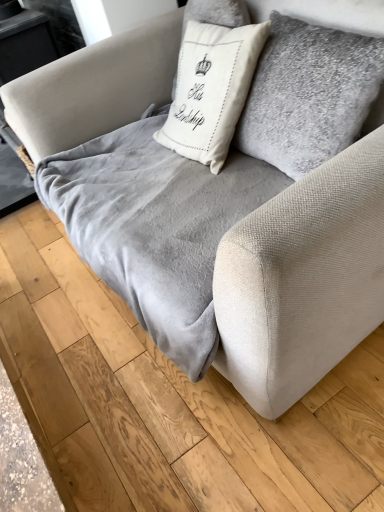
Question: Can velvet gray blanket at center be found inside white cotton cushion at center?

Choices:
 (A) no
 (B) yes

Answer: (A)

Question: Can you confirm if white cotton cushion at center is smaller than velvet gray blanket at center?

Choices:
 (A) yes
 (B) no

Answer: (A)

Question: From a real-world perspective, is white cotton cushion at center physically above velvet gray blanket at center?

Choices:
 (A) no
 (B) yes

Answer: (B)

Question: Does white cotton cushion at center have a greater width compared to velvet gray blanket at center?

Choices:
 (A) no
 (B) yes

Answer: (A)

Question: Is white cotton cushion at center positioned beyond the bounds of velvet gray blanket at center?

Choices:
 (A) yes
 (B) no

Answer: (A)

Question: Does white cotton cushion at center appear on the right side of velvet gray blanket at center?

Choices:
 (A) yes
 (B) no

Answer: (A)

Question: Is velvet gray blanket at center completely or partially outside of white cotton cushion at center?

Choices:
 (A) yes
 (B) no

Answer: (A)

Question: From a real-world perspective, is velvet gray blanket at center located beneath white cotton cushion at center?

Choices:
 (A) yes
 (B) no

Answer: (A)

Question: Can you confirm if velvet gray blanket at center is wider than white cotton cushion at center?

Choices:
 (A) no
 (B) yes

Answer: (B)

Question: From a real-world perspective, does velvet gray blanket at center stand above white cotton cushion at center?

Choices:
 (A) no
 (B) yes

Answer: (A)

Question: Is velvet gray blanket at center oriented towards white cotton cushion at center?

Choices:
 (A) yes
 (B) no

Answer: (B)

Question: Considering the relative sizes of velvet gray blanket at center and white cotton cushion at center in the image provided, is velvet gray blanket at center taller than white cotton cushion at center?

Choices:
 (A) yes
 (B) no

Answer: (B)

Question: Considering the positions of velvet gray blanket at center and white cotton cushion at center in the image, is velvet gray blanket at center taller or shorter than white cotton cushion at center?

Choices:
 (A) short
 (B) tall

Answer: (A)